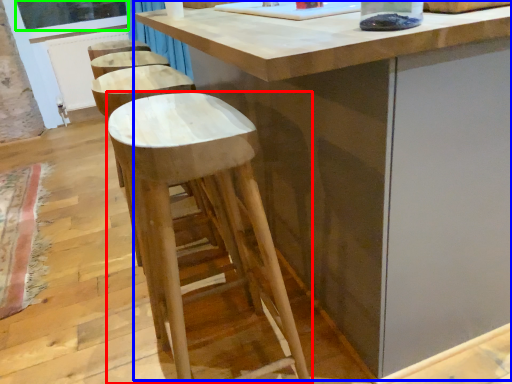
Question: Considering the real-world distances, which object is closest to stool (highlighted by a red box)? table (highlighted by a blue box) or window screen (highlighted by a green box).

Choices:
 (A) table
 (B) window screen

Answer: (A)